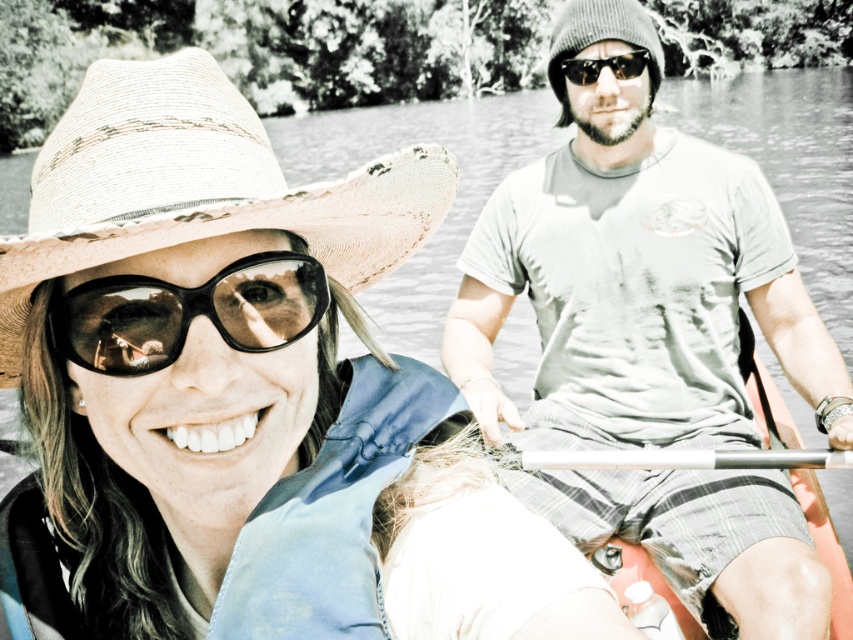
In the scene shown: Can you confirm if matte gray t-shirt at center is positioned to the left of black matte sunglasses at center?

No, matte gray t-shirt at center is not to the left of black matte sunglasses at center.

Who is higher up, matte gray t-shirt at center or black matte sunglasses at center?

Positioned higher is black matte sunglasses at center.

The height and width of the screenshot is (640, 853). What are the coordinates of `matte gray t-shirt at center` in the screenshot? It's located at (x=634, y=273).

Between point (801, 630) and point (165, 154), which one is positioned behind?

Point (801, 630)

You are a GUI agent. You are given a task and a screenshot of the screen. Output one action in this format:
    pyautogui.click(x=<x>, y=<y>)
    Task: Click on the matte gray t-shirt at center
    
    Given the screenshot: What is the action you would take?
    pyautogui.click(x=634, y=273)

Looking at this image, measure the distance between point (96, 232) and camera.

Point (96, 232) is 33.25 inches from camera.

This screenshot has width=853, height=640. What do you see at coordinates (198, 186) in the screenshot? I see `natural straw cowboy hat at left` at bounding box center [198, 186].

Who is more forward, (x=444, y=196) or (x=590, y=64)?

Point (x=444, y=196) is in front.

This screenshot has height=640, width=853. What are the coordinates of `natural straw cowboy hat at left` in the screenshot? It's located at (198, 186).